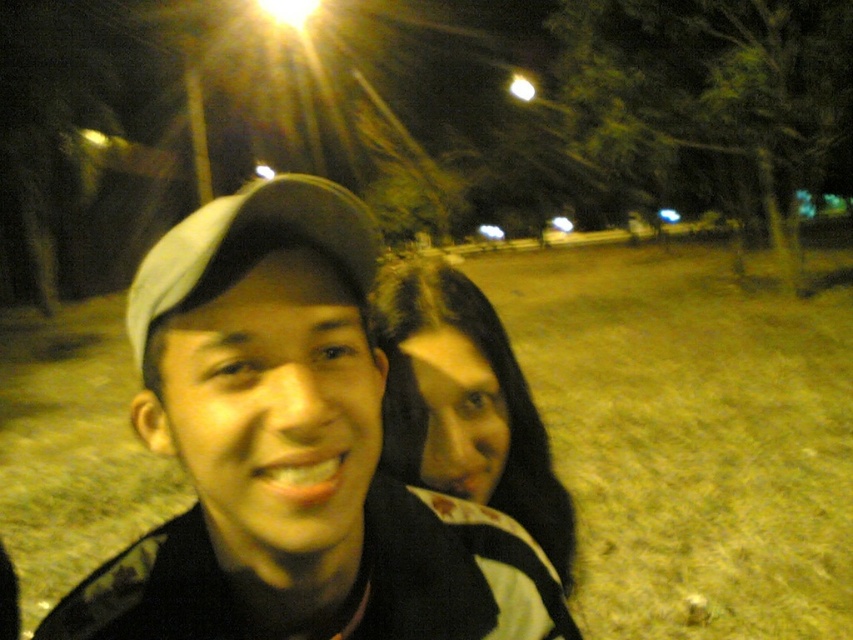
Question: Which point is closer to the camera taking this photo?

Choices:
 (A) (474, 400)
 (B) (296, 461)

Answer: (B)

Question: Does matte black cap at center appear on the left side of dark brown hair at center?

Choices:
 (A) no
 (B) yes

Answer: (B)

Question: Can you confirm if matte black cap at center is positioned to the right of dark brown hair at center?

Choices:
 (A) yes
 (B) no

Answer: (B)

Question: Which of the following is the farthest from the observer?

Choices:
 (A) dark brown hair at center
 (B) matte black cap at center

Answer: (A)

Question: Where is matte black cap at center located in relation to dark brown hair at center in the image?

Choices:
 (A) above
 (B) below

Answer: (A)